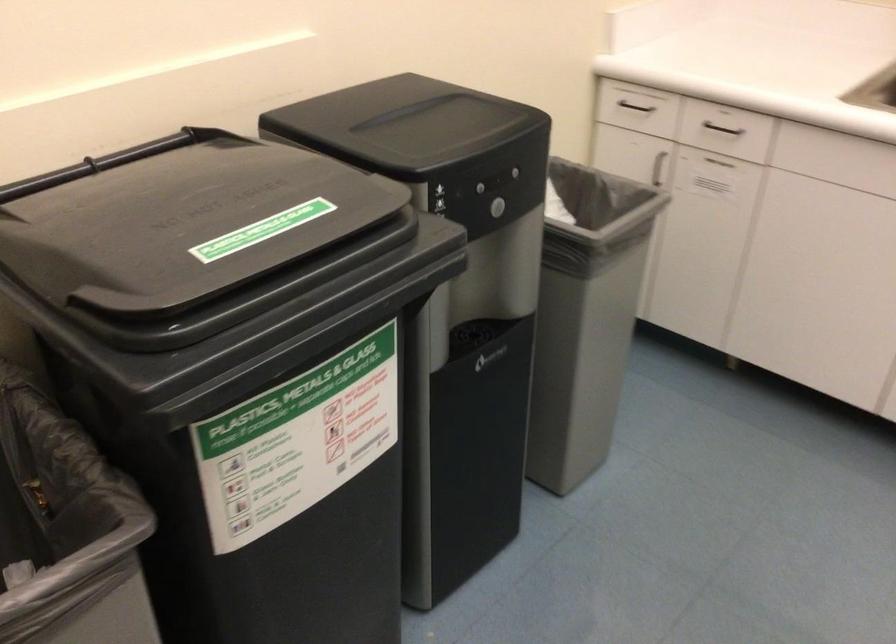
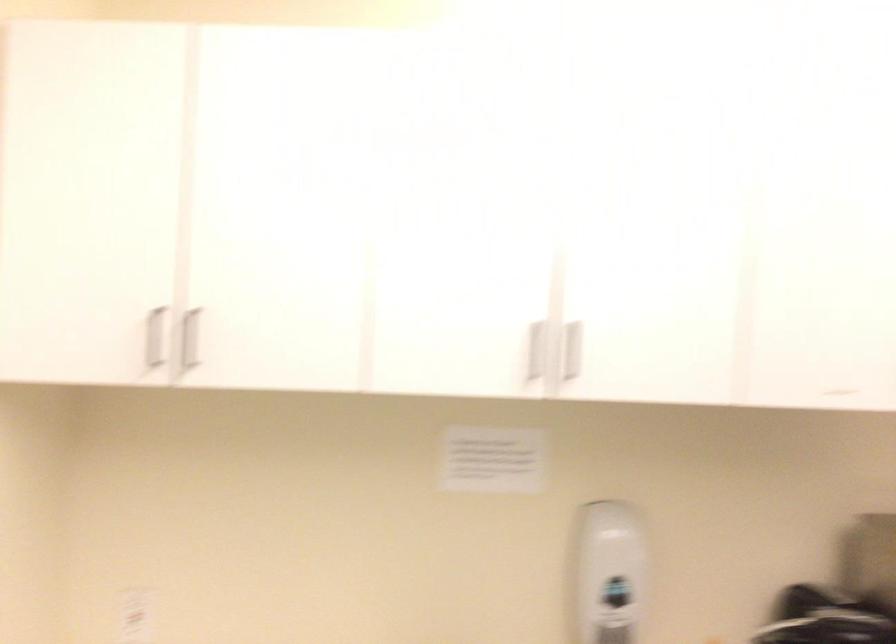
How did the camera likely rotate?

The rotation direction of the camera is right-up.